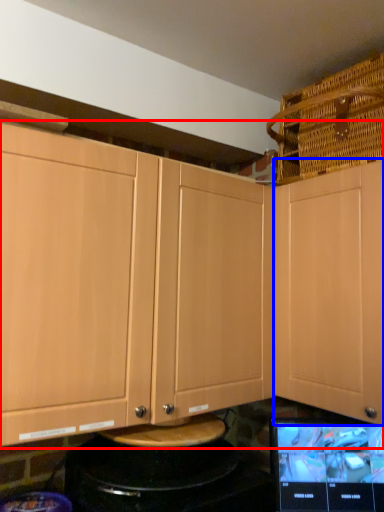
Question: Which point is closer to the camera, cabinetry (highlighted by a red box) or cabinetry (highlighted by a blue box)?

Choices:
 (A) cabinetry
 (B) cabinetry

Answer: (A)